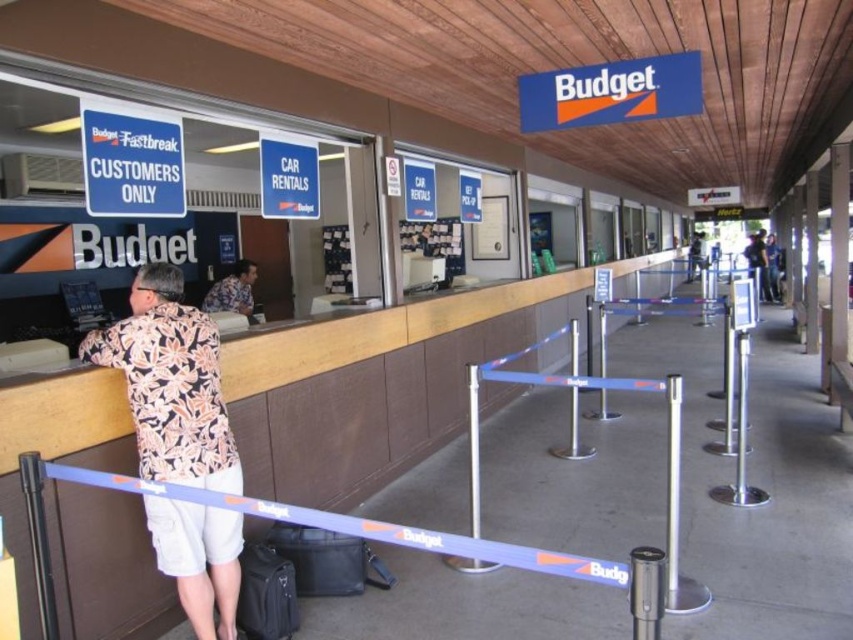
Is black fabric suitcase at lower left wider than floral shirt at center?

No, black fabric suitcase at lower left is not wider than floral shirt at center.

Between black fabric suitcase at lower left and floral shirt at center, which one is positioned higher?

floral shirt at center is above.

Between point (282, 604) and point (231, 301), which one is positioned behind?

The point (231, 301) is more distant.

Identify the location of black fabric suitcase at lower left. The width and height of the screenshot is (853, 640). (265, 595).

Does hawaiian print shirt at left have a lesser height compared to black fabric suitcase at lower left?

In fact, hawaiian print shirt at left may be taller than black fabric suitcase at lower left.

Consider the image. Which is above, hawaiian print shirt at left or black fabric suitcase at lower left?

hawaiian print shirt at left

The height and width of the screenshot is (640, 853). What are the coordinates of `hawaiian print shirt at left` in the screenshot? It's located at (170, 384).

Between black leather suitcase at lower center and black fabric suitcase at lower left, which one is positioned higher?

black leather suitcase at lower center is above.

Image resolution: width=853 pixels, height=640 pixels. Describe the element at coordinates (321, 557) in the screenshot. I see `black leather suitcase at lower center` at that location.

Locate an element on the screen. This screenshot has width=853, height=640. black leather suitcase at lower center is located at coordinates (321, 557).